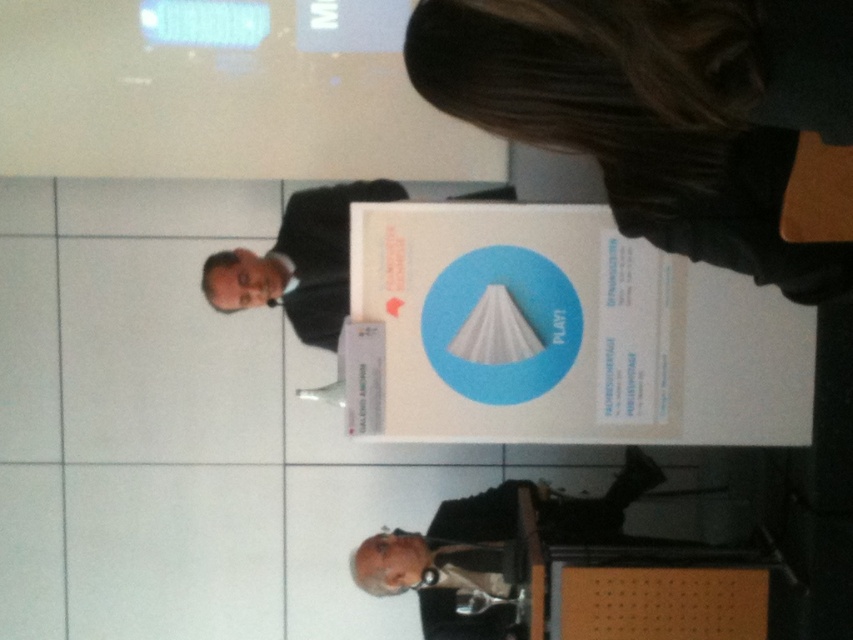
Question: Where is black fabric hair at upper center located in relation to black suit at center in the image?

Choices:
 (A) left
 (B) right

Answer: (B)

Question: In this image, where is black fabric hair at upper center located relative to black suit at center?

Choices:
 (A) right
 (B) left

Answer: (A)

Question: Can you confirm if black fabric hair at upper center is positioned to the right of black suit at center?

Choices:
 (A) yes
 (B) no

Answer: (A)